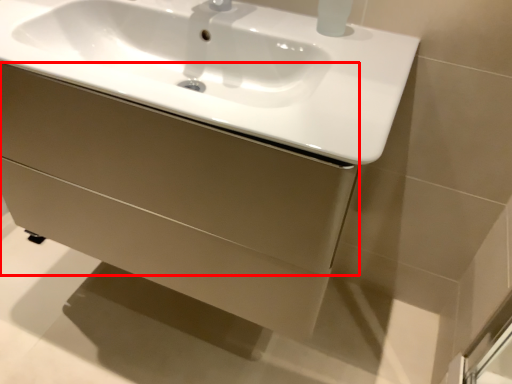
Question: From the image, what is the correct spatial relationship of drawer (annotated by the red box) in relation to sink?

Choices:
 (A) right
 (B) left

Answer: (B)